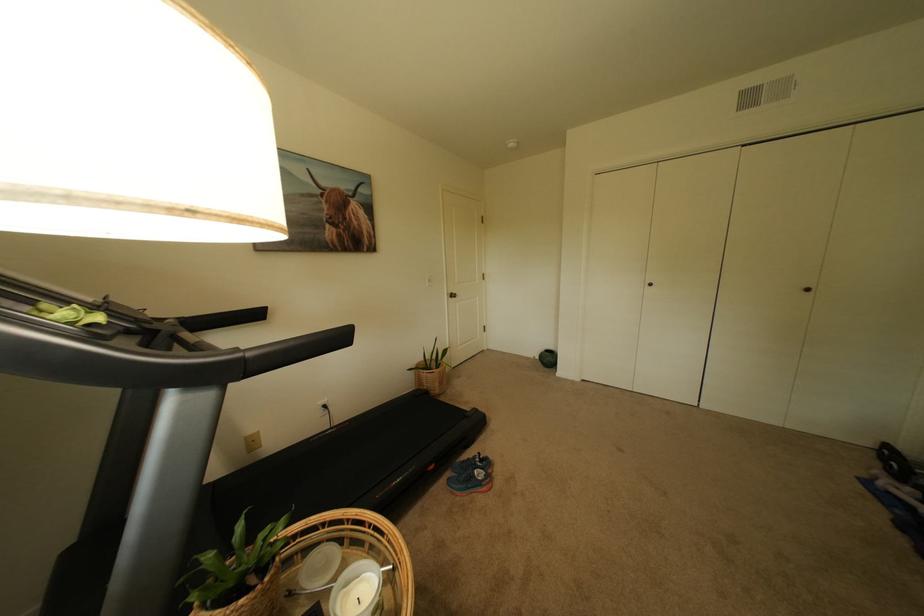
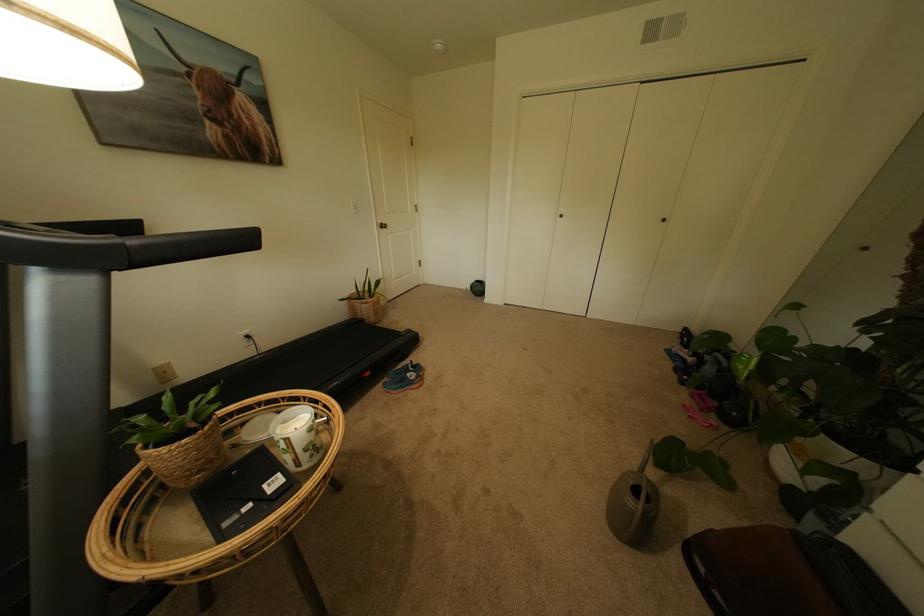
The point at (332, 211) is marked in the first image. Where is the corresponding point in the second image?

(204, 100)